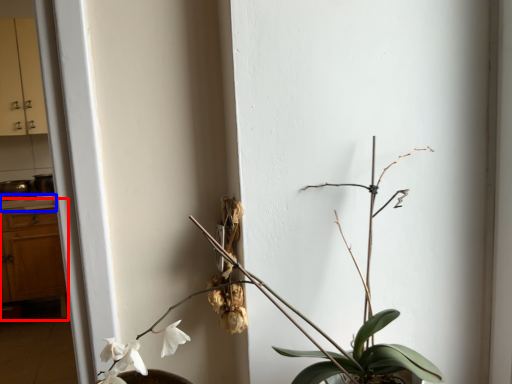
Question: Which of the following is the farthest to the observer, dresser (highlighted by a red box) or counter top (highlighted by a blue box)?

Choices:
 (A) dresser
 (B) counter top

Answer: (B)